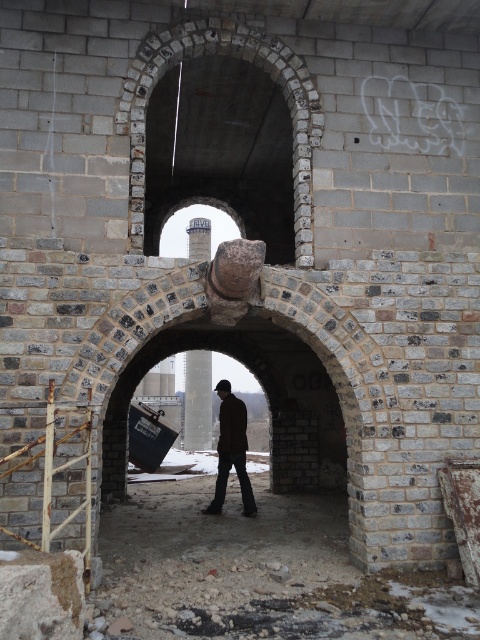
Is brick stone archway at upper center shorter than brown leather jacket at center?

No.

This screenshot has width=480, height=640. I want to click on brick stone archway at upper center, so click(x=243, y=58).

Where is `brick stone archway at upper center`? This screenshot has height=640, width=480. brick stone archway at upper center is located at coordinates pos(243,58).